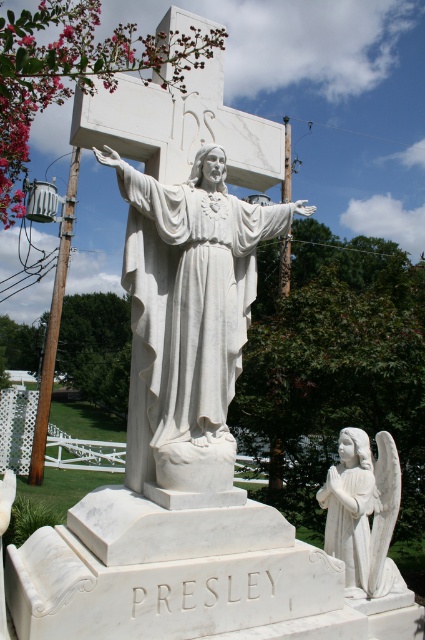
You are an art student analyzing the monument. You notice the white marble statue at center and the white marble angel at lower right. Which one has a greater height?

The white marble statue at center is taller than the white marble angel at lower right.

Based on the scene description, what are the coordinates of the white marble statue at center?

The white marble statue at center is located at coordinates point (187, 323).

You are standing in front of the marble monument and want to touch both the white marble statue at center and the white marble angel at lower right. Which one can you reach first without moving your position?

The white marble statue at center is closer to the viewer than the white marble angel at lower right, so you can reach it first without moving.